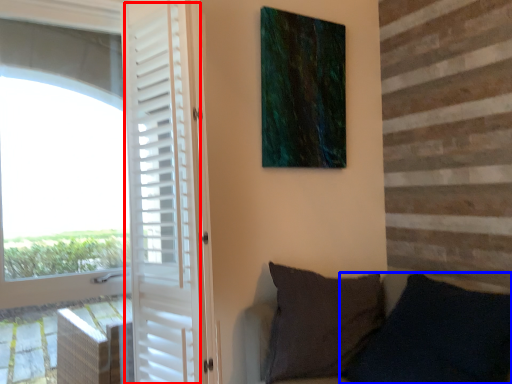
Question: Which object is further to the camera taking this photo, screen door (highlighted by a red box) or pillow (highlighted by a blue box)?

Choices:
 (A) screen door
 (B) pillow

Answer: (A)